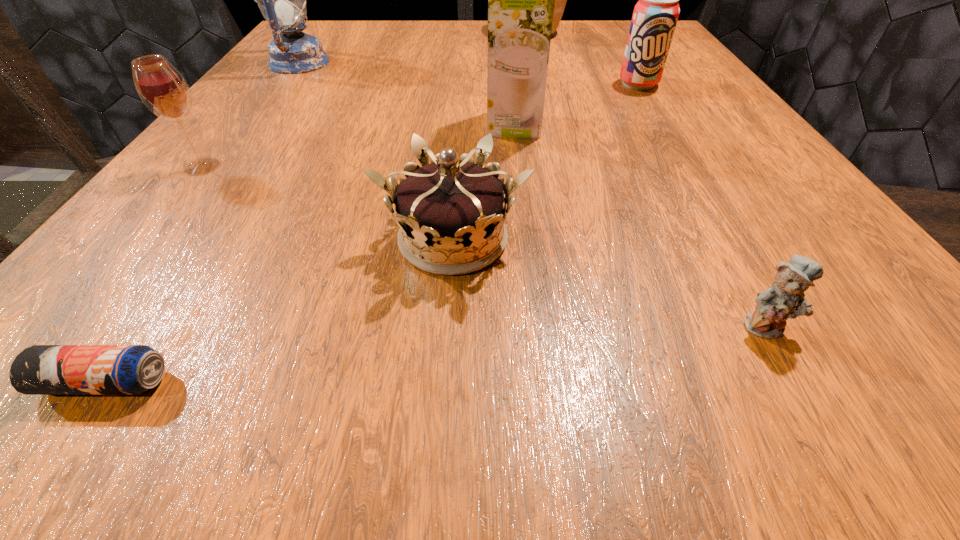
This screenshot has width=960, height=540. I want to click on beer can, so click(40, 369).

Find the location of a particular element. Image resolution: width=960 pixels, height=540 pixels. vacant space located 0.090m at the spout of the pitcher is located at coordinates (460, 32).

You are a GUI agent. You are given a task and a screenshot of the screen. Output one action in this format:
    pyautogui.click(x=<x>, y=<y>)
    Task: Click on the vacant point located 0.090m at the spout of the pitcher
    
    Given the screenshot: What is the action you would take?
    pyautogui.click(x=460, y=32)

You are a GUI agent. You are given a task and a screenshot of the screen. Output one action in this format:
    pyautogui.click(x=<x>, y=<y>)
    Task: Click on the free space located at the spout of the pitcher
    The width and height of the screenshot is (960, 540).
    Given the screenshot: What is the action you would take?
    pyautogui.click(x=447, y=32)

At what (x,y) coordinates should I click in order to perform the action: click on free space located on the front-facing side of the lantern. Please return your answer as a coordinate pair (x, y). Looking at the image, I should click on (503, 63).

Where is `free space located 0.120m on the right of the soya milk`? This screenshot has width=960, height=540. free space located 0.120m on the right of the soya milk is located at coordinates (616, 124).

Identify the location of free space located 0.260m on the back of the wineglass. (270, 83).

Image resolution: width=960 pixels, height=540 pixels. What are the coordinates of `free space located on the left of the soda can` in the screenshot? It's located at (468, 84).

The width and height of the screenshot is (960, 540). I want to click on vacant area located on the right of the sixth tallest object, so click(606, 239).

I want to click on blank space located on the right of the nearest object, so click(x=407, y=382).